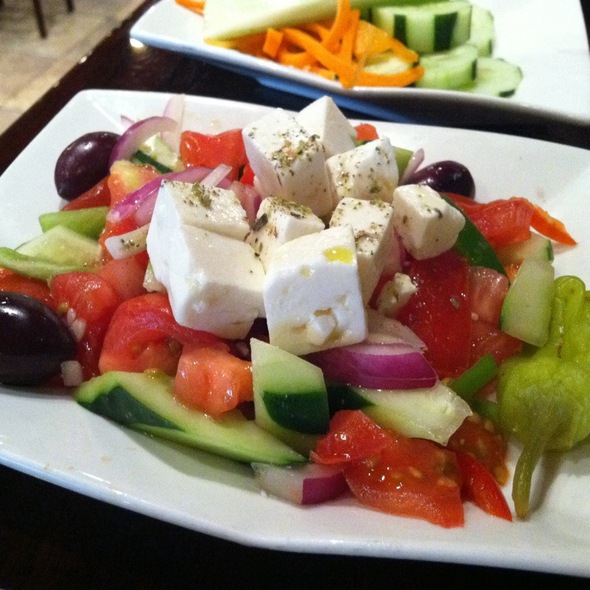
Locate an element on the screen. The image size is (590, 590). brown floor is located at coordinates (26, 40).